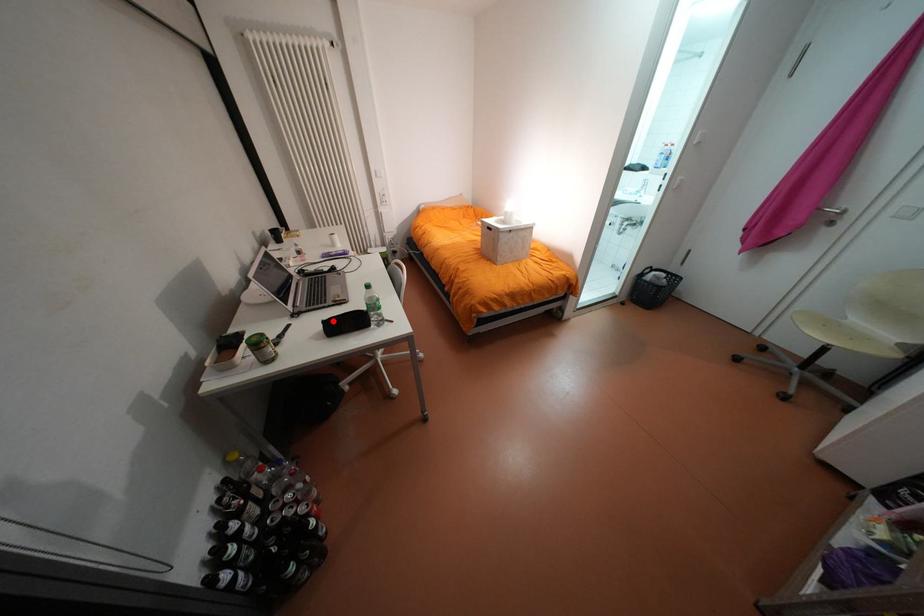
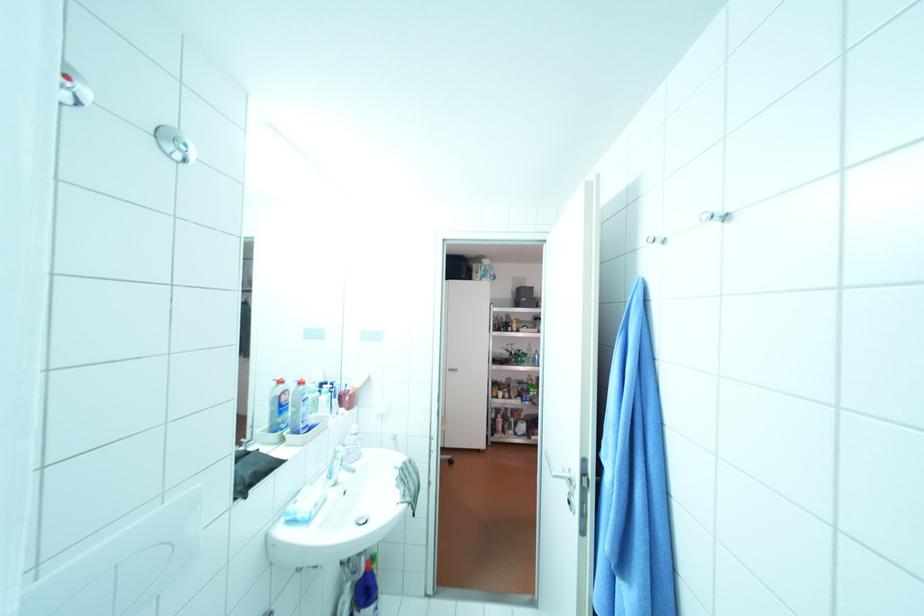
Question: I am providing you with two images of the same scene from different viewpoints. A red point is marked on the first image. Is the red point's position out of view in image 2?

Choices:
 (A) Yes
 (B) No

Answer: (A)